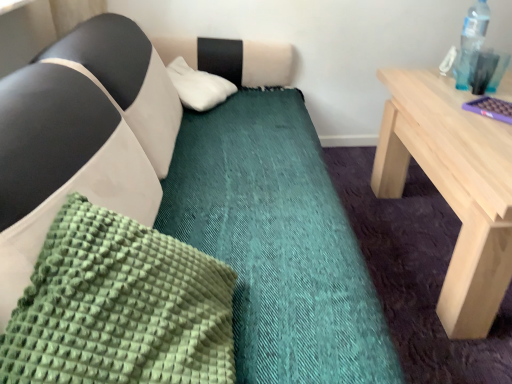
Question: Can you confirm if white fluffy pillow at upper center, which is the 1th pillow from top to bottom, is thinner than transparent plastic bottle at upper right?

Choices:
 (A) no
 (B) yes

Answer: (A)

Question: From a real-world perspective, is white fluffy pillow at upper center, the second pillow when ordered from front to back, positioned over transparent plastic bottle at upper right based on gravity?

Choices:
 (A) yes
 (B) no

Answer: (B)

Question: Is white fluffy pillow at upper center, the second pillow when ordered from front to back, wider than transparent plastic bottle at upper right?

Choices:
 (A) yes
 (B) no

Answer: (A)

Question: Can we say white fluffy pillow at upper center, which is the 1th pillow from top to bottom, lies outside transparent plastic bottle at upper right?

Choices:
 (A) no
 (B) yes

Answer: (B)

Question: Considering the relative positions of white fluffy pillow at upper center, placed as the second pillow when sorted from bottom to top, and transparent plastic bottle at upper right in the image provided, is white fluffy pillow at upper center, placed as the second pillow when sorted from bottom to top, to the left of transparent plastic bottle at upper right from the viewer's perspective?

Choices:
 (A) yes
 (B) no

Answer: (A)

Question: Does white fluffy pillow at upper center, marked as the first pillow in a back-to-front arrangement, turn towards transparent plastic bottle at upper right?

Choices:
 (A) yes
 (B) no

Answer: (A)

Question: Can you confirm if transparent plastic bottle at upper right is positioned to the right of green textured pillow at lower left, arranged as the 1th pillow when viewed from the front?

Choices:
 (A) no
 (B) yes

Answer: (B)

Question: Is transparent plastic bottle at upper right surrounding green textured pillow at lower left, which appears as the 2th pillow when viewed from the back?

Choices:
 (A) no
 (B) yes

Answer: (A)

Question: Is transparent plastic bottle at upper right far away from green textured pillow at lower left, the 1th pillow from the bottom?

Choices:
 (A) yes
 (B) no

Answer: (A)

Question: Is green textured pillow at lower left, arranged as the 1th pillow when viewed from the front, at the back of transparent plastic bottle at upper right?

Choices:
 (A) no
 (B) yes

Answer: (A)

Question: Is transparent plastic bottle at upper right aimed at green textured pillow at lower left, the 1th pillow from the bottom?

Choices:
 (A) yes
 (B) no

Answer: (B)

Question: Can you confirm if transparent plastic bottle at upper right is positioned to the left of green textured pillow at lower left, which appears as the 2th pillow when viewed from the back?

Choices:
 (A) yes
 (B) no

Answer: (B)

Question: Is green textured pillow at lower left, which appears as the 2th pillow when viewed from the back, oriented towards transparent plastic bottle at upper right?

Choices:
 (A) no
 (B) yes

Answer: (A)